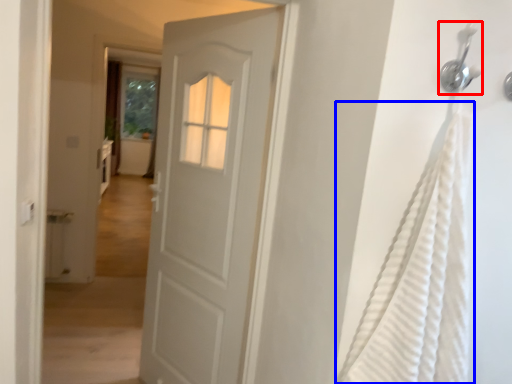
Question: Which object appears closest to the camera in this image, shower (highlighted by a red box) or shower curtain (highlighted by a blue box)?

Choices:
 (A) shower
 (B) shower curtain

Answer: (B)